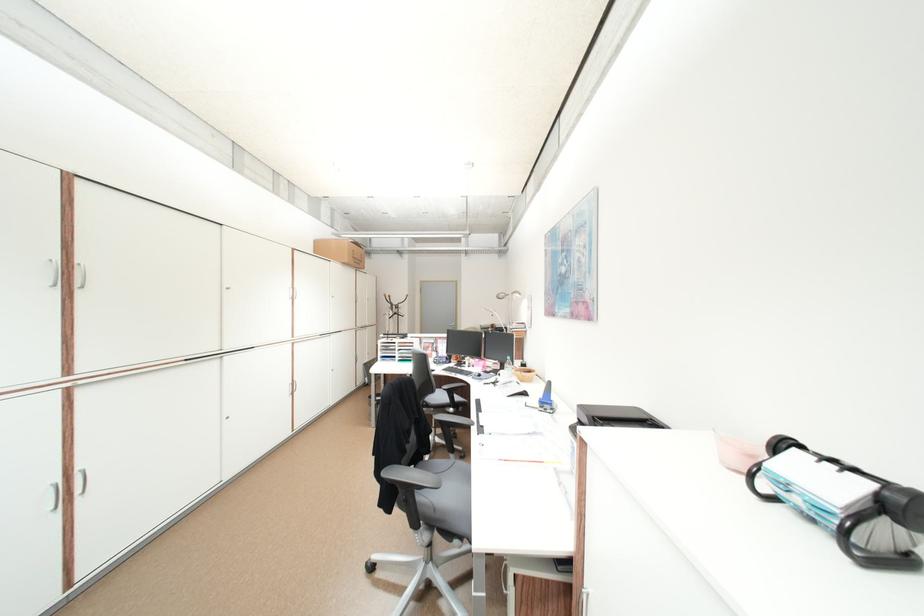
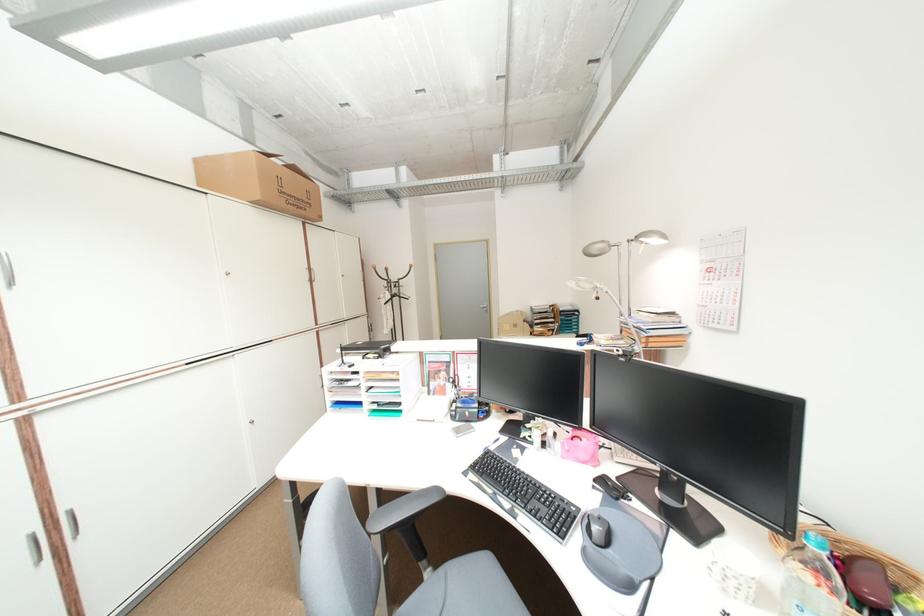
The point at (400, 314) is marked in the first image. Where is the corresponding point in the second image?

(397, 296)